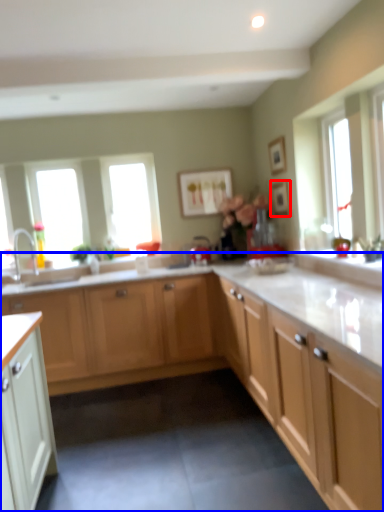
Question: Which object is further to the camera taking this photo, picture frame (highlighted by a red box) or cabinetry (highlighted by a blue box)?

Choices:
 (A) picture frame
 (B) cabinetry

Answer: (A)